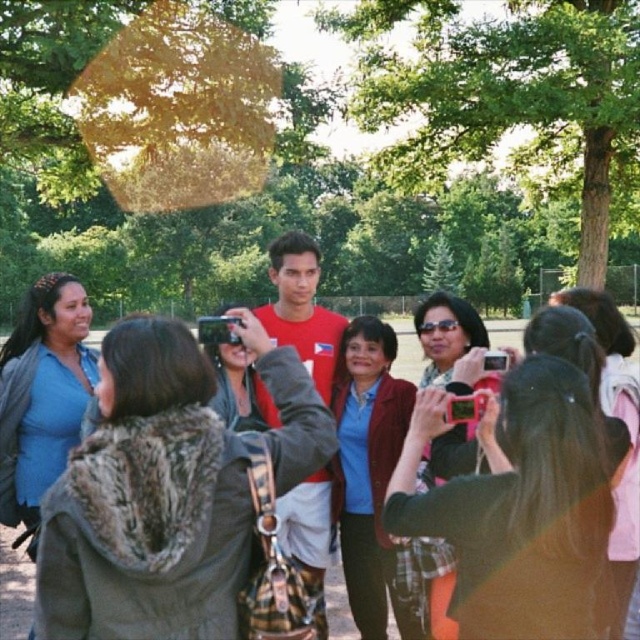
You are a photographer trying to capture the green leafy tree at center and the pink plastic camera at center in the same frame. Which object should you focus on first if you want both to be in focus?

Since the green leafy tree at center is larger than the pink plastic camera at center, you should focus on the green leafy tree at center first to ensure both are in focus.

You are a photographer trying to capture a clear shot of the matte black jacket at center and the matte blue shirt at left. Since you want to ensure both are visible, which one should you focus on first to account for their sizes?

The matte black jacket at center is taller than the matte blue shirt at left, so you should focus on the matte black jacket at center first to ensure its details are captured clearly before adjusting for the smaller matte blue shirt at left.